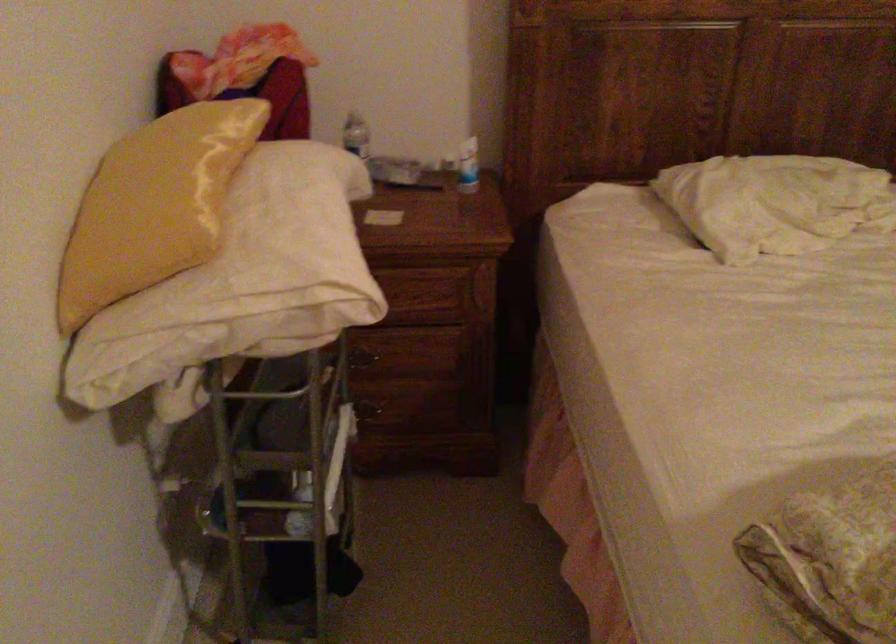
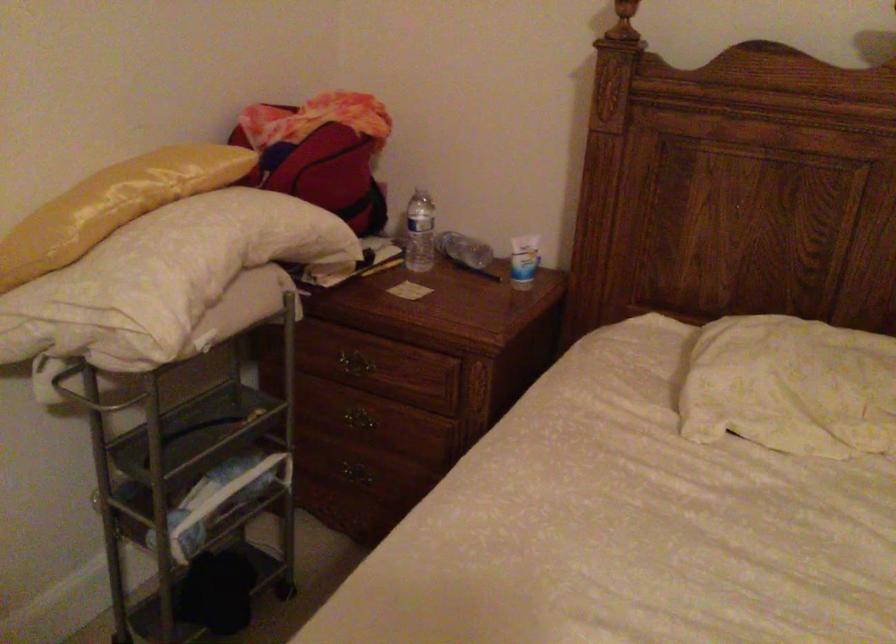
Find the pixel in the second image that matches the point at 332,245 in the first image.

(164, 278)